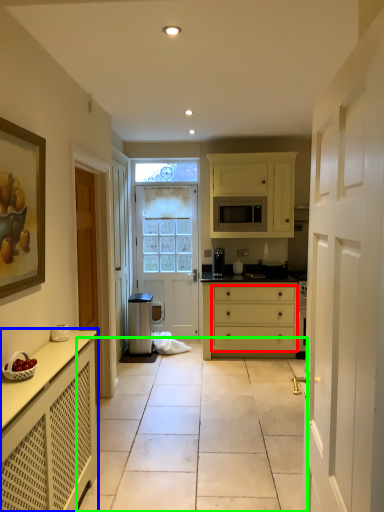
Question: Based on their relative distances, which object is farther from drawer (highlighted by a red box)? Choose from cabinetry (highlighted by a blue box) and path (highlighted by a green box).

Choices:
 (A) cabinetry
 (B) path

Answer: (A)